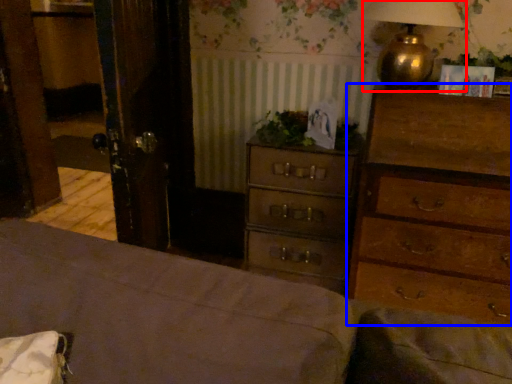
Question: Which object is closer to the camera taking this photo, table lamp (highlighted by a red box) or chest of drawers (highlighted by a blue box)?

Choices:
 (A) table lamp
 (B) chest of drawers

Answer: (B)